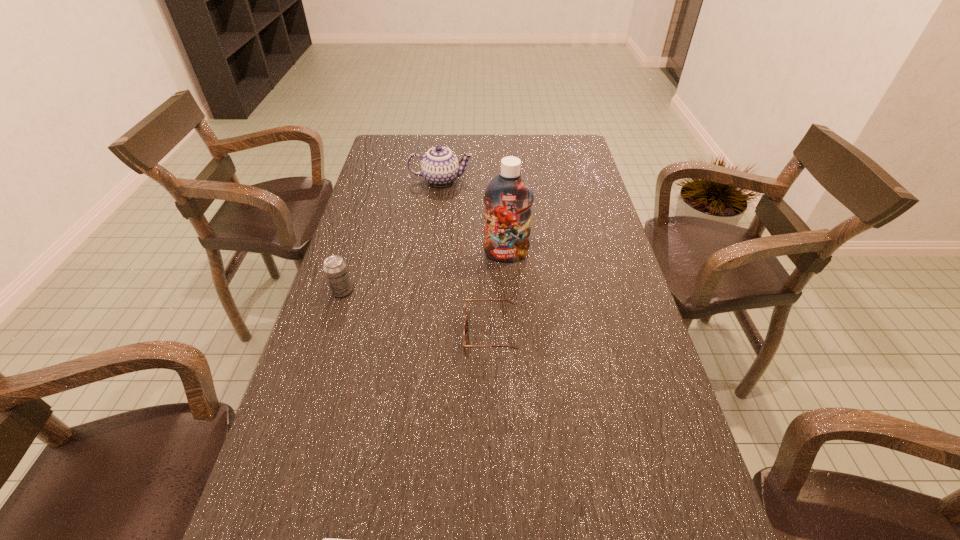
Where is `the second farthest object`? Image resolution: width=960 pixels, height=540 pixels. the second farthest object is located at coordinates (508, 198).

Find the location of a particular element. the tallest object is located at coordinates (508, 198).

Where is `the farthest object`? the farthest object is located at coordinates (440, 167).

The width and height of the screenshot is (960, 540). In order to click on chinaware in this screenshot , I will do `click(440, 167)`.

The height and width of the screenshot is (540, 960). I want to click on beer can, so click(x=335, y=269).

Where is `the leftmost object`? the leftmost object is located at coordinates (335, 269).

In order to click on the fourth farthest object in this screenshot , I will do `click(465, 322)`.

You are a GUI agent. You are given a task and a screenshot of the screen. Output one action in this format:
    pyautogui.click(x=<x>, y=<y>)
    Task: Click on the fourth tallest object
    This screenshot has width=960, height=540.
    Given the screenshot: What is the action you would take?
    pyautogui.click(x=465, y=322)

Where is `free space located 0.050m on the front label of the tallest object`? The image size is (960, 540). free space located 0.050m on the front label of the tallest object is located at coordinates (507, 276).

Identify the location of free space located from the spout of the farthest object. This screenshot has height=540, width=960. (571, 180).